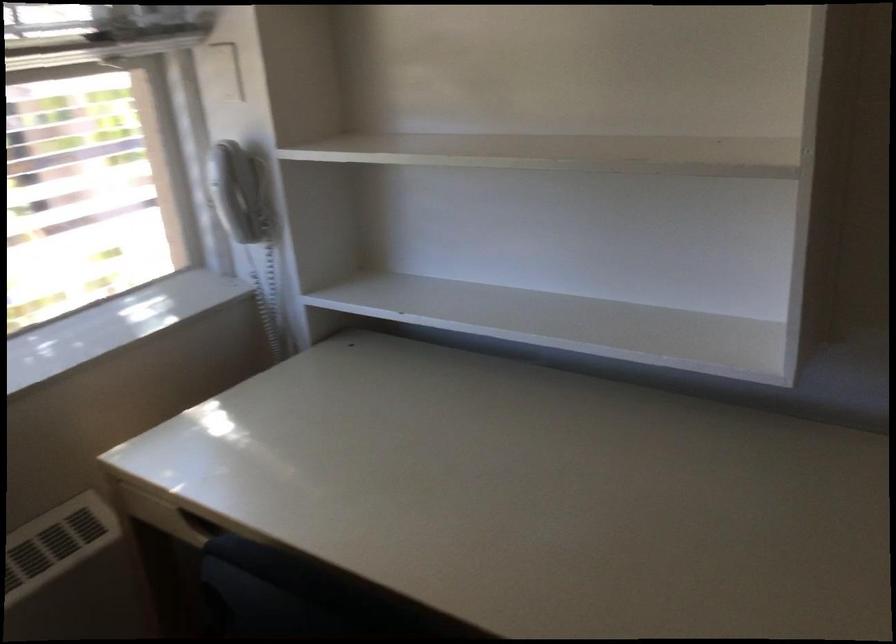
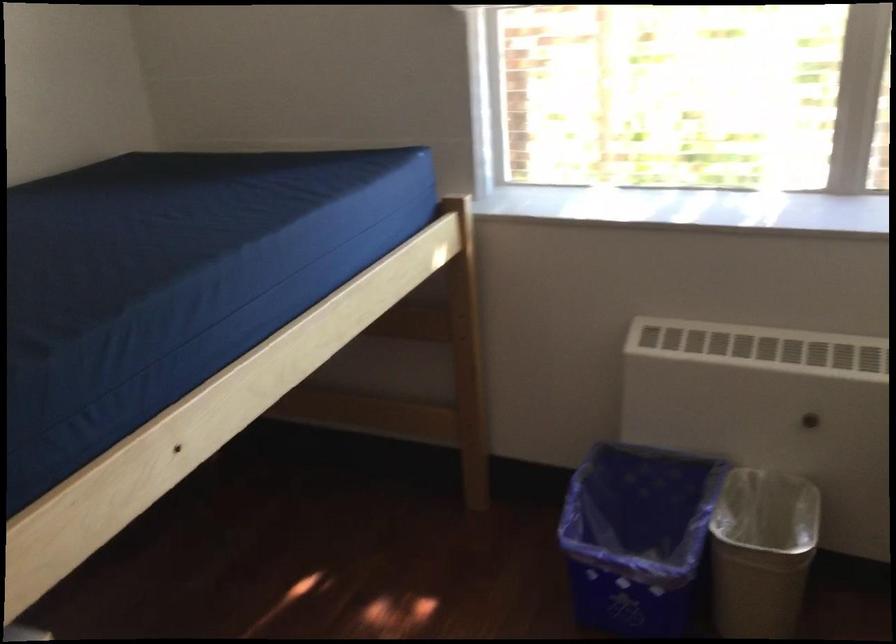
The first image is from the beginning of the video and the second image is from the end. How did the camera likely rotate when shooting the video?

The rotation direction of the camera is left-down.